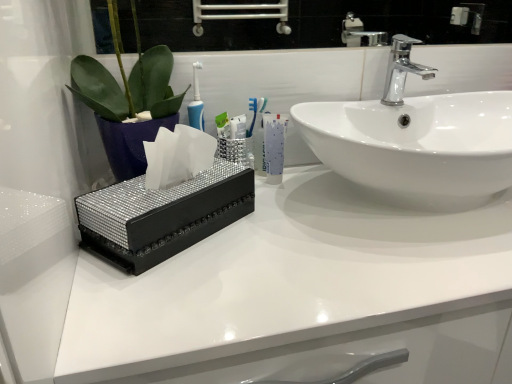
The width and height of the screenshot is (512, 384). In order to click on free space in front of sparkly black tissue box at center in this screenshot , I will do `click(172, 294)`.